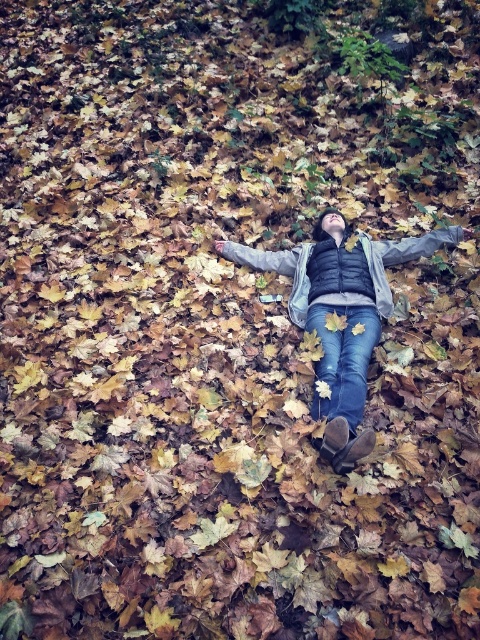
Question: Does denim jeans at center appear over jeans at center?

Choices:
 (A) no
 (B) yes

Answer: (B)

Question: Among these points, which one is farthest from the camera?

Choices:
 (A) (330, 412)
 (B) (348, 404)

Answer: (A)

Question: Which object appears closest to the camera in this image?

Choices:
 (A) denim jeans at center
 (B) jeans at center

Answer: (A)

Question: Can you confirm if denim jeans at center is positioned below jeans at center?

Choices:
 (A) no
 (B) yes

Answer: (A)

Question: Is denim jeans at center positioned before jeans at center?

Choices:
 (A) no
 (B) yes

Answer: (B)